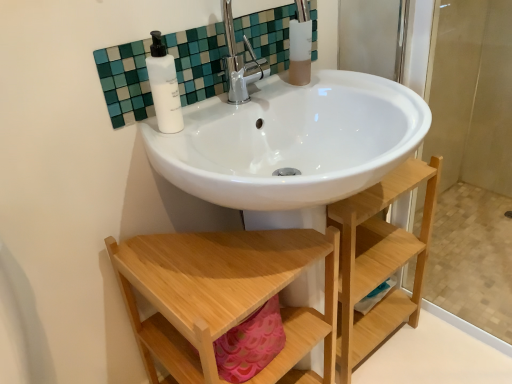
Question: Is white glossy sink at upper center to the right of natural wood shelf at lower center from the viewer's perspective?

Choices:
 (A) yes
 (B) no

Answer: (B)

Question: From the image's perspective, would you say white glossy sink at upper center is shown under natural wood shelf at lower center?

Choices:
 (A) no
 (B) yes

Answer: (A)

Question: Does white glossy sink at upper center have a lesser height compared to natural wood shelf at lower center?

Choices:
 (A) yes
 (B) no

Answer: (A)

Question: Is white glossy sink at upper center positioned in front of natural wood shelf at lower center?

Choices:
 (A) yes
 (B) no

Answer: (B)

Question: Considering the relative sizes of white glossy sink at upper center and natural wood shelf at lower center in the image provided, is white glossy sink at upper center smaller than natural wood shelf at lower center?

Choices:
 (A) yes
 (B) no

Answer: (A)

Question: From the image's perspective, is white glossy sink at upper center on top of natural wood shelf at lower center?

Choices:
 (A) no
 (B) yes

Answer: (B)

Question: Does white glossy sink at upper center have a smaller size compared to translucent frosted glass cup at upper center?

Choices:
 (A) no
 (B) yes

Answer: (A)

Question: Is white glossy sink at upper center oriented away from translucent frosted glass cup at upper center?

Choices:
 (A) yes
 (B) no

Answer: (A)

Question: Is white glossy sink at upper center bigger than translucent frosted glass cup at upper center?

Choices:
 (A) yes
 (B) no

Answer: (A)

Question: Is translucent frosted glass cup at upper center located within white glossy sink at upper center?

Choices:
 (A) no
 (B) yes

Answer: (A)

Question: From a real-world perspective, does white glossy sink at upper center stand above translucent frosted glass cup at upper center?

Choices:
 (A) yes
 (B) no

Answer: (B)

Question: Is white glossy sink at upper center at the right side of translucent frosted glass cup at upper center?

Choices:
 (A) no
 (B) yes

Answer: (A)

Question: Is natural wood shelf at lower center completely or partially outside of white glossy sink at upper center?

Choices:
 (A) no
 (B) yes

Answer: (B)